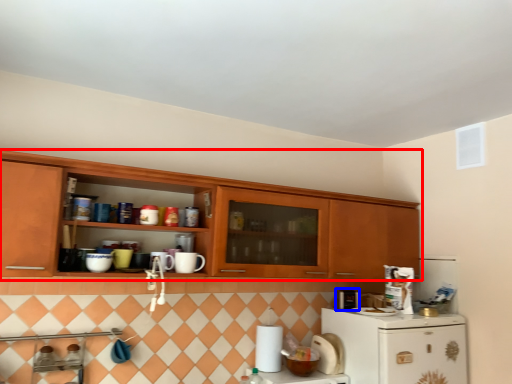
Question: Which object appears closest to the camera in this image, cabinetry (highlighted by a red box) or appliance (highlighted by a blue box)?

Choices:
 (A) cabinetry
 (B) appliance

Answer: (A)